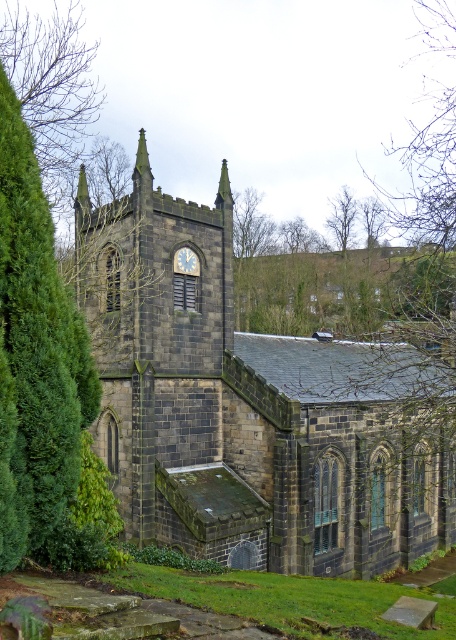
Question: From the image, what is the correct spatial relationship of green leafy tree at center in relation to blue stone clock at center?

Choices:
 (A) left
 (B) right

Answer: (B)

Question: Which object appears farthest from the camera in this image?

Choices:
 (A) green leafy tree at center
 (B) brown wood tree at upper left
 (C) brown textured tree at upper center

Answer: (C)

Question: Which of these objects is positioned farthest from the dark gray stone church at center?

Choices:
 (A) brown textured tree at upper center
 (B) green leafy tree at center
 (C) brown wood tree at upper left

Answer: (C)

Question: Can you confirm if dark gray stone church at center is positioned below brown wood tree at upper left?

Choices:
 (A) no
 (B) yes

Answer: (B)

Question: Can you confirm if brown wood tree at upper left is bigger than blue stone clock at center?

Choices:
 (A) no
 (B) yes

Answer: (A)

Question: Which is nearer to the green leafy tree at upper center?

Choices:
 (A) brown wood tree at upper center
 (B) green leafy tree at center
 (C) brown wood tree at upper left

Answer: (A)